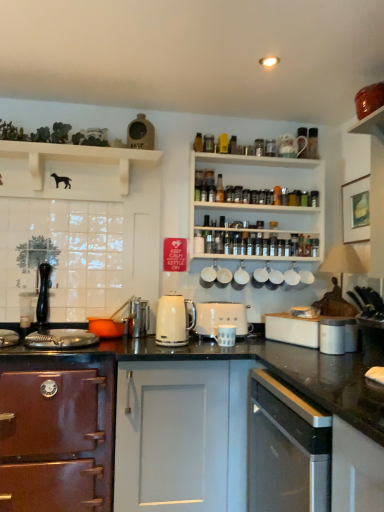
Question: Considering the relative positions of white wooden shelf at upper center, which appears as the 2th shelf when viewed from the left, and white matte cup at upper center, positioned as the 2th appliance in right-to-left order, in the image provided, is white wooden shelf at upper center, which appears as the 2th shelf when viewed from the left, in front of white matte cup at upper center, positioned as the 2th appliance in right-to-left order,?

Choices:
 (A) no
 (B) yes

Answer: (B)

Question: Is the surface of white wooden shelf at upper center, positioned as the first shelf in right-to-left order, in direct contact with white matte cup at upper center, positioned as the 2th appliance in right-to-left order?

Choices:
 (A) no
 (B) yes

Answer: (A)

Question: Does white wooden shelf at upper center, positioned as the first shelf in right-to-left order, appear on the right side of white matte cup at upper center, which ranks as the eighth appliance in left-to-right order?

Choices:
 (A) no
 (B) yes

Answer: (A)

Question: Could you tell me if white wooden shelf at upper center, arranged as the second shelf when viewed from the front, is turned towards white matte cup at upper center, positioned as the 2th appliance in right-to-left order?

Choices:
 (A) no
 (B) yes

Answer: (A)

Question: Is white wooden shelf at upper center, arranged as the second shelf when viewed from the front, shorter than white matte cup at upper center, which ranks as the eighth appliance in left-to-right order?

Choices:
 (A) yes
 (B) no

Answer: (B)

Question: From the image's perspective, is black matte faucet at left positioned above or below white wood shelf at upper left, which is counted as the second shelf, starting from the back?

Choices:
 (A) above
 (B) below

Answer: (B)

Question: Would you say black matte faucet at left is to the left or to the right of white wood shelf at upper left, the 1th shelf in the front-to-back sequence, in the picture?

Choices:
 (A) right
 (B) left

Answer: (B)

Question: From a real-world perspective, is black matte faucet at left positioned above or below white wood shelf at upper left, the first shelf when ordered from left to right?

Choices:
 (A) below
 (B) above

Answer: (A)

Question: Does point (39, 295) appear closer or farther from the camera than point (81, 154)?

Choices:
 (A) closer
 (B) farther

Answer: (B)

Question: Looking at their shapes, would you say white ceramic mugs at center, which is the fourth appliance from right to left, is wider or thinner than white ceramic mug at upper center, marked as the 5th appliance in a left-to-right arrangement?

Choices:
 (A) wide
 (B) thin

Answer: (B)

Question: Is white ceramic mugs at center, which is the fourth appliance from right to left, inside the boundaries of white ceramic mug at upper center, acting as the fifth appliance starting from the right, or outside?

Choices:
 (A) outside
 (B) inside

Answer: (A)

Question: Visually, is white ceramic mugs at center, which is the fourth appliance from right to left, positioned to the left or to the right of white ceramic mug at upper center, acting as the fifth appliance starting from the right?

Choices:
 (A) left
 (B) right

Answer: (B)

Question: In the image, is white ceramic mugs at center, which is the fourth appliance from right to left, positioned in front of or behind white ceramic mug at upper center, marked as the 5th appliance in a left-to-right arrangement?

Choices:
 (A) behind
 (B) front

Answer: (A)

Question: Is white ceramic mugs at center, which is the fourth appliance from right to left, taller or shorter than white matte coffee cup at center, which ranks as the third appliance in right-to-left order?

Choices:
 (A) tall
 (B) short

Answer: (A)

Question: In terms of width, does white ceramic mugs at center, which is the fourth appliance from right to left, look wider or thinner when compared to white matte coffee cup at center, which ranks as the third appliance in right-to-left order?

Choices:
 (A) thin
 (B) wide

Answer: (A)